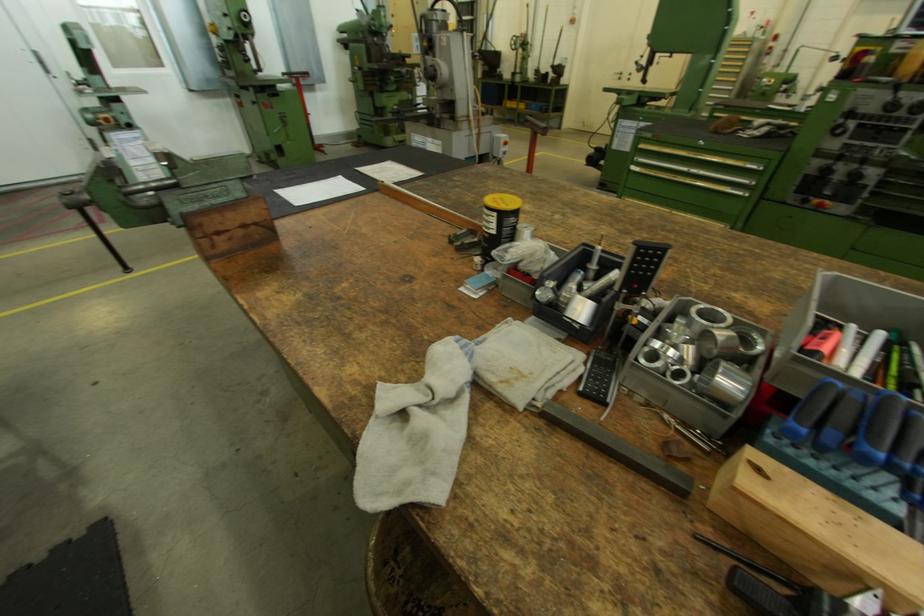
Identify the location of yellow container lid. The width and height of the screenshot is (924, 616). (502, 201).